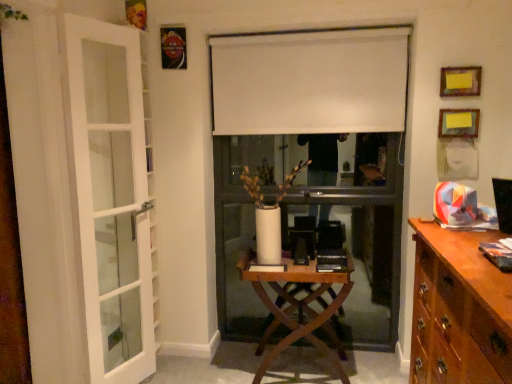
Question: From the image's perspective, is white matte curtain at center located above wooden picture frame at upper right, which appears as the 2th picture frame when ordered from the bottom?

Choices:
 (A) no
 (B) yes

Answer: (B)

Question: Can you confirm if white matte curtain at center is thinner than wooden picture frame at upper right, which is the 1th picture frame in top-to-bottom order?

Choices:
 (A) no
 (B) yes

Answer: (A)

Question: Does white matte curtain at center have a lesser height compared to wooden picture frame at upper right, which is the 1th picture frame in top-to-bottom order?

Choices:
 (A) no
 (B) yes

Answer: (A)

Question: Is white matte curtain at center to the right of wooden picture frame at upper right, which appears as the 2th picture frame when ordered from the bottom, from the viewer's perspective?

Choices:
 (A) yes
 (B) no

Answer: (B)

Question: Does white matte curtain at center have a larger size compared to wooden picture frame at upper right, which is the 1th picture frame in top-to-bottom order?

Choices:
 (A) no
 (B) yes

Answer: (B)

Question: Is there a large distance between white matte curtain at center and wooden picture frame at upper right, which is the 1th picture frame in top-to-bottom order?

Choices:
 (A) no
 (B) yes

Answer: (A)

Question: From the image's perspective, would you say wooden picture frame at upper right, which appears as the 2th picture frame when ordered from the bottom, is positioned over white glass door at left?

Choices:
 (A) yes
 (B) no

Answer: (A)

Question: Is wooden picture frame at upper right, which is the 1th picture frame in top-to-bottom order, outside of white glass door at left?

Choices:
 (A) no
 (B) yes

Answer: (B)

Question: From a real-world perspective, is wooden picture frame at upper right, which is the 1th picture frame in top-to-bottom order, on white glass door at left?

Choices:
 (A) yes
 (B) no

Answer: (A)

Question: Does wooden picture frame at upper right, which appears as the 2th picture frame when ordered from the bottom, come in front of white glass door at left?

Choices:
 (A) yes
 (B) no

Answer: (B)

Question: Is wooden picture frame at upper right, which is the 1th picture frame in top-to-bottom order, to the right of white glass door at left from the viewer's perspective?

Choices:
 (A) no
 (B) yes

Answer: (B)

Question: Are wooden picture frame at upper right, which is the 1th picture frame in top-to-bottom order, and white glass door at left beside each other?

Choices:
 (A) yes
 (B) no

Answer: (B)

Question: Considering the relative sizes of wooden at center and white matte curtain at center in the image provided, is wooden at center taller than white matte curtain at center?

Choices:
 (A) yes
 (B) no

Answer: (A)